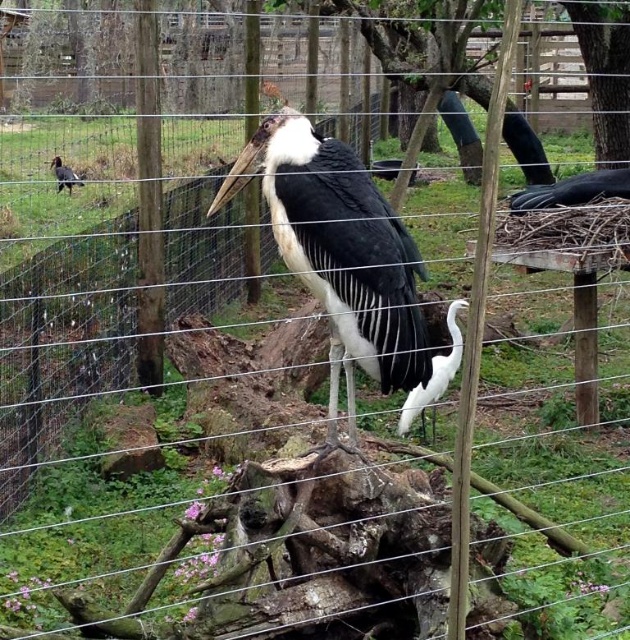
Does point (246, 161) come in front of point (454, 339)?

Yes, point (246, 161) is closer to viewer.

Find the location of a particular element. Image resolution: width=630 pixels, height=640 pixels. white feathered bird at center is located at coordinates (340, 256).

Can you confirm if white glossy egret at center is wider than shiny black bird at left?

No, white glossy egret at center is not wider than shiny black bird at left.

Is white glossy egret at center positioned before shiny black bird at left?

Yes, it is in front of shiny black bird at left.

Which is behind, point (421, 436) or point (64, 168)?

Positioned behind is point (64, 168).

Where is `white glossy egret at center`? The width and height of the screenshot is (630, 640). white glossy egret at center is located at coordinates (433, 376).

Does white feathered bird at center have a lesser height compared to shiny black bird at left?

Incorrect, white feathered bird at center's height does not fall short of shiny black bird at left's.

Between point (278, 227) and point (79, 180), which one is positioned in front?

Point (278, 227) is in front.

Find the location of a particular element. This screenshot has width=630, height=640. white feathered bird at center is located at coordinates (340, 256).